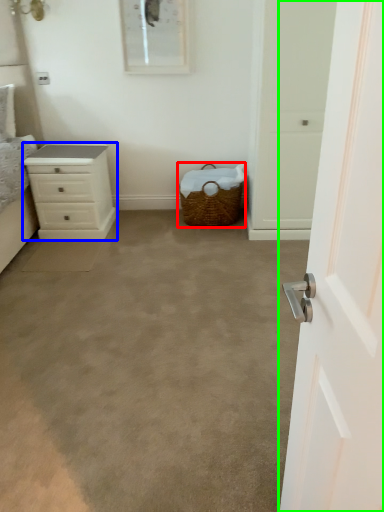
Question: Which is nearer to the picnic basket (highlighted by a red box)? chest of drawers (highlighted by a blue box) or door (highlighted by a green box).

Choices:
 (A) chest of drawers
 (B) door

Answer: (A)